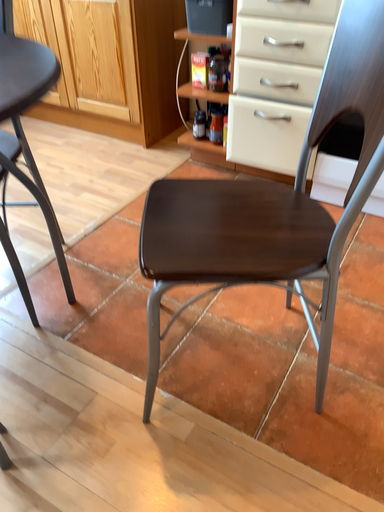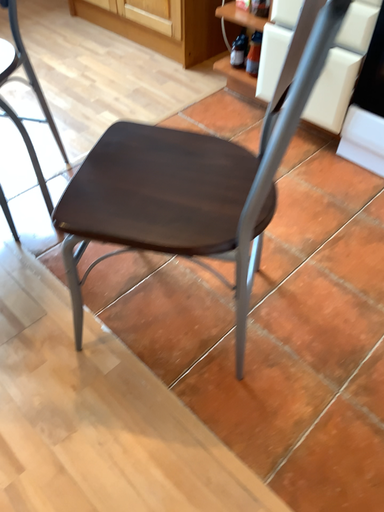
Question: Which way did the camera rotate in the video?

Choices:
 (A) rotated downward
 (B) rotated upward

Answer: (A)